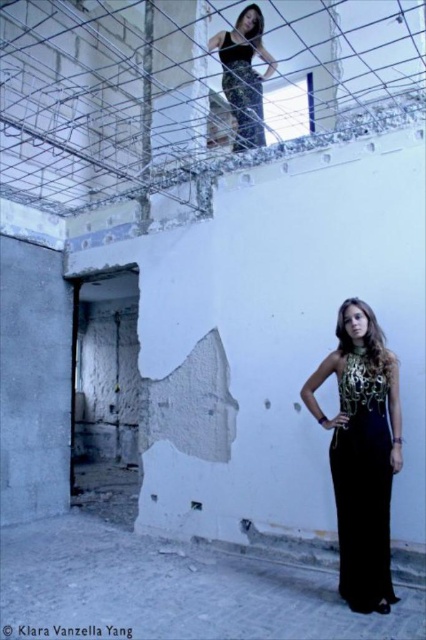
You are an interior designer planning to install a new lighting fixture. You need to determine if the shiny black dress at upper center will be visible through the metallic wire mesh at upper center. Based on the scene description, can you confirm if the dress is visible through the mesh?

The shiny black dress at upper center is behind the metallic wire mesh at upper center, so it may be partially visible depending on the mesh density, but the description does not provide details about the mesh transparency or density.

You are an interior designer observing the scene. You need to place a decorative vase between the black satin dress at lower center and the shiny black dress at upper center. Based on their positions, which dress should the vase be closer to?

The vase should be placed closer to the shiny black dress at upper center because the black satin dress at lower center is to the right of the shiny black dress at upper center, meaning the shiny black dress is on the left side relative to the black satin dress.